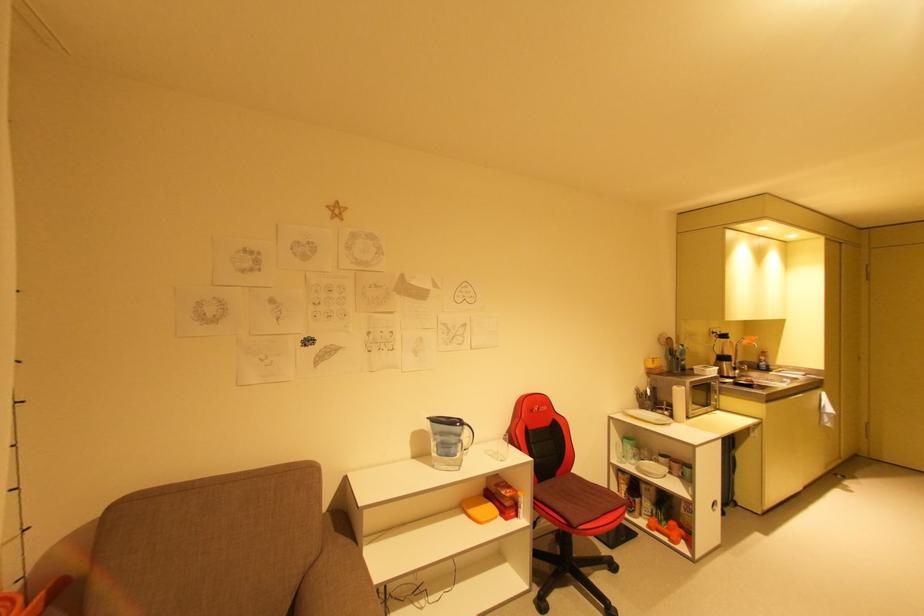
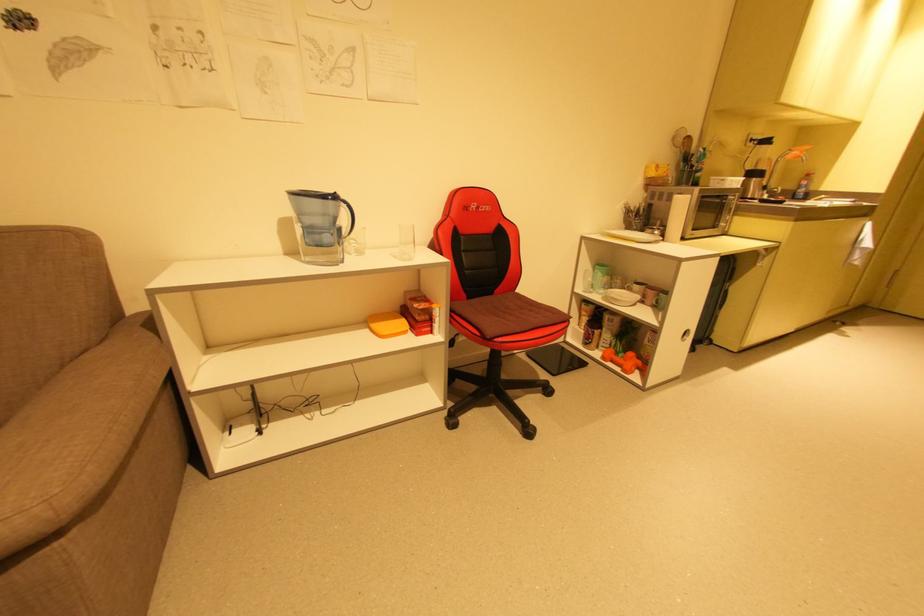
Find the pixel in the second image that matches the point at 469,427 in the first image.

(346, 204)